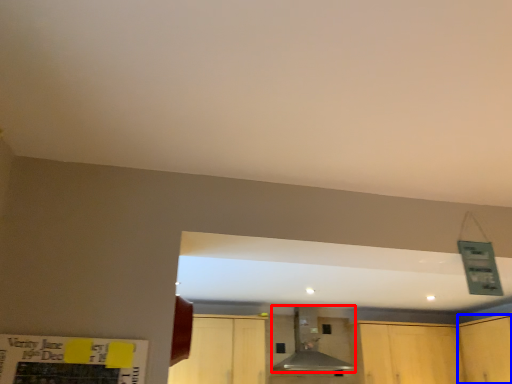
Question: Among these objects, which one is nearest to the camera, vent (highlighted by a red box) or cabinetry (highlighted by a blue box)?

Choices:
 (A) vent
 (B) cabinetry

Answer: (B)